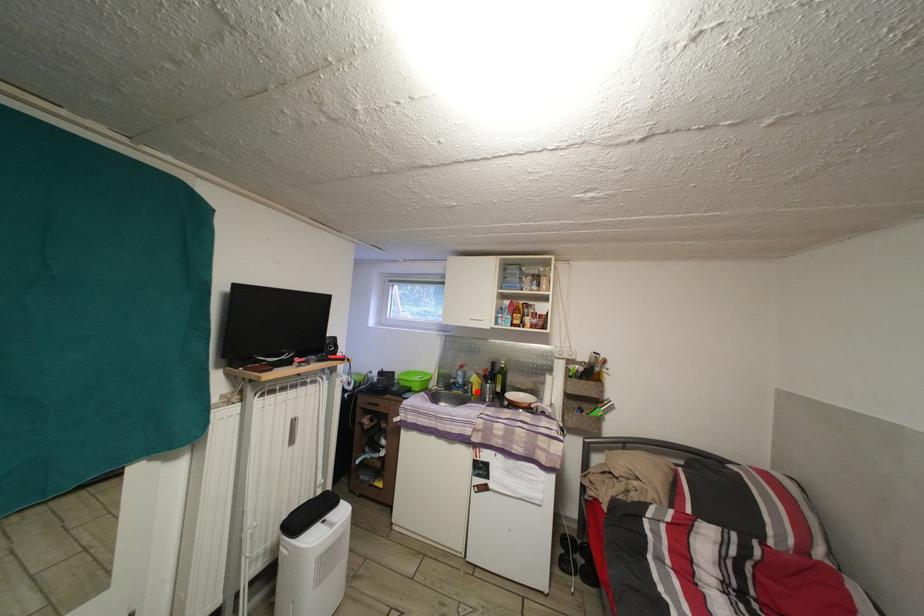
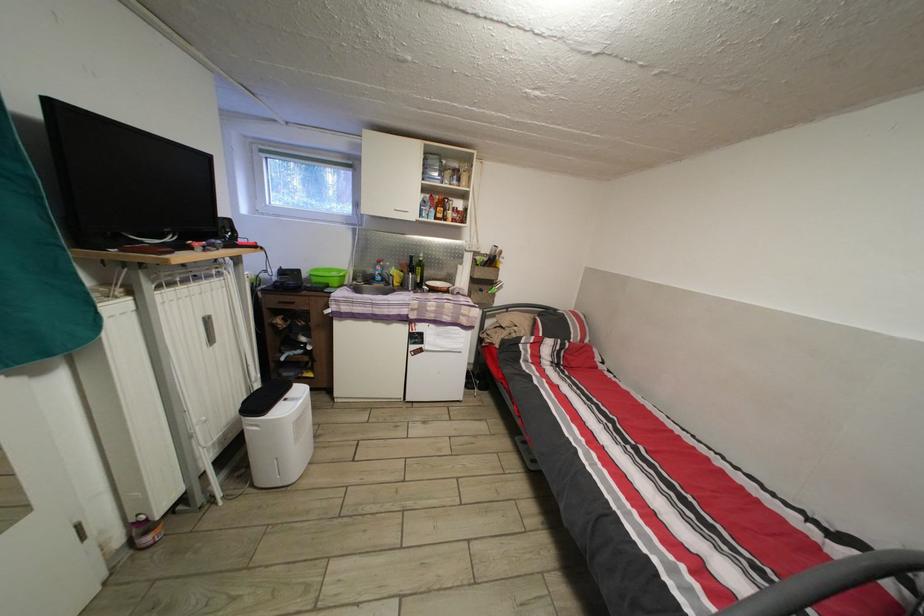
Question: I am providing you with two images of the same scene from different viewpoints. A red point is marked on the first image. Is the red point's position out of view in image 2?

Choices:
 (A) Yes
 (B) No

Answer: (B)